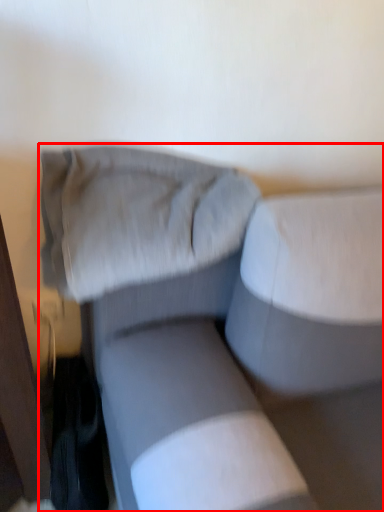
Question: From the image's perspective, where is studio couch (annotated by the red box) located in relation to pillow in the image?

Choices:
 (A) above
 (B) below

Answer: (B)